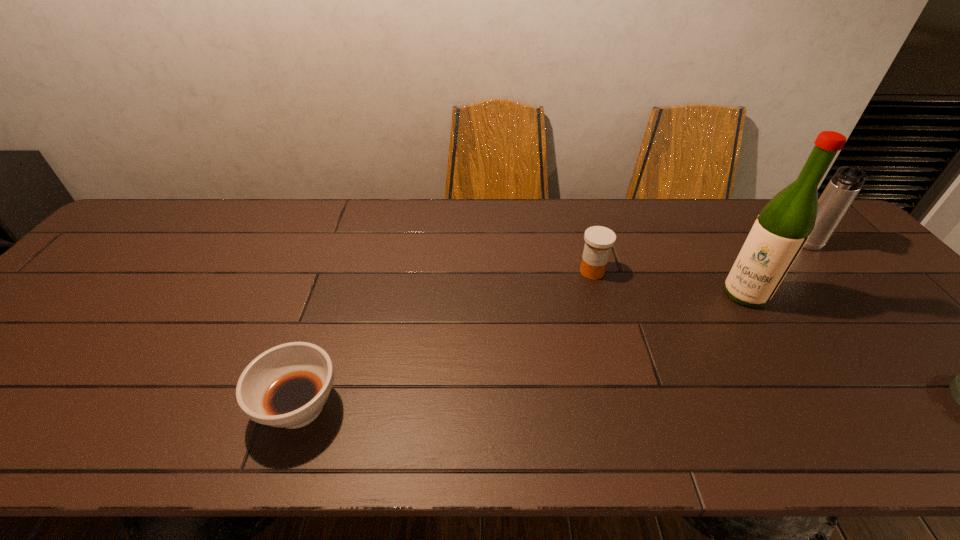
Find the location of a particular element. This screenshot has height=540, width=960. vacant space located on the label of the third tallest object is located at coordinates (606, 296).

You are a GUI agent. You are given a task and a screenshot of the screen. Output one action in this format:
    pyautogui.click(x=<x>, y=<y>)
    Task: Click on the free space located 0.230m on the label of the third tallest object
    Image resolution: width=960 pixels, height=540 pixels.
    Given the screenshot: What is the action you would take?
    pyautogui.click(x=635, y=348)

Where is `vacant space located 0.270m on the handle side of the thermos bottle`? The image size is (960, 540). vacant space located 0.270m on the handle side of the thermos bottle is located at coordinates coord(765,300).

Where is `vacant space located on the handle side of the thermos bottle`? This screenshot has height=540, width=960. vacant space located on the handle side of the thermos bottle is located at coordinates (786, 273).

Where is `free space located on the handle side of the thermos bottle`? This screenshot has width=960, height=540. free space located on the handle side of the thermos bottle is located at coordinates (782, 278).

The image size is (960, 540). I want to click on free space located on the label of the liquor, so click(x=727, y=314).

Find the location of `vacant region located on the label of the liquor`. vacant region located on the label of the liquor is located at coordinates (691, 354).

Locate an element on the screen. The image size is (960, 540). vacant space located on the label of the liquor is located at coordinates (671, 376).

Where is `object located in the far edge section of the desktop`? object located in the far edge section of the desktop is located at coordinates (844, 186).

You are a GUI agent. You are given a task and a screenshot of the screen. Output one action in this format:
    pyautogui.click(x=<x>, y=<y>)
    Task: Click on the object at the near edge
    Image resolution: width=960 pixels, height=540 pixels.
    Given the screenshot: What is the action you would take?
    pyautogui.click(x=286, y=386)